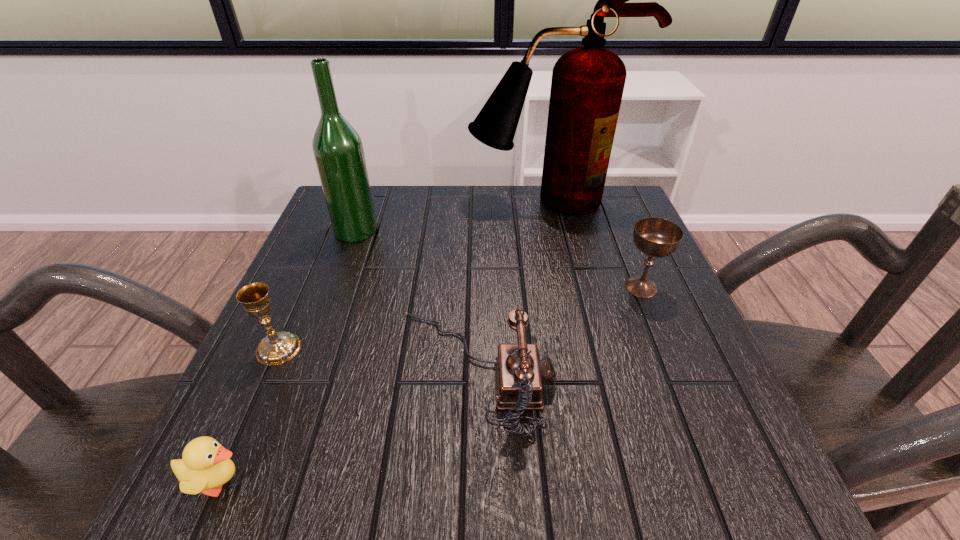
Image resolution: width=960 pixels, height=540 pixels. I want to click on the farthest object, so click(587, 85).

Where is `the tallest object`? the tallest object is located at coordinates (587, 85).

This screenshot has height=540, width=960. In order to click on alcohol in this screenshot , I will do `click(338, 151)`.

The width and height of the screenshot is (960, 540). I want to click on the fifth shortest object, so click(338, 151).

You are a GUI agent. You are given a task and a screenshot of the screen. Output one action in this format:
    pyautogui.click(x=<x>, y=<y>)
    Task: Click on the right chalice
    This screenshot has height=540, width=960.
    Given the screenshot: What is the action you would take?
    pyautogui.click(x=655, y=237)

This screenshot has height=540, width=960. Identify the location of the farther chalice. (655, 237).

Locate an element on the screen. the left chalice is located at coordinates (276, 348).

Locate an element on the screen. The width and height of the screenshot is (960, 540). telephone is located at coordinates (519, 374).

This screenshot has width=960, height=540. Identify the location of the shortest object. (205, 466).

Identify the location of duckling. (205, 466).